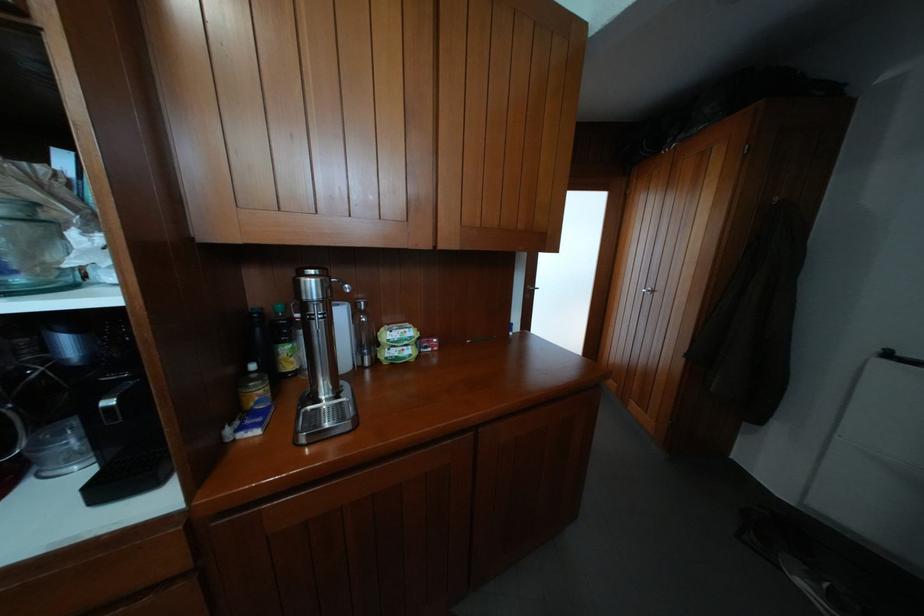
The location [258,341] corresponds to which object?

This point indicates the dark bottle.